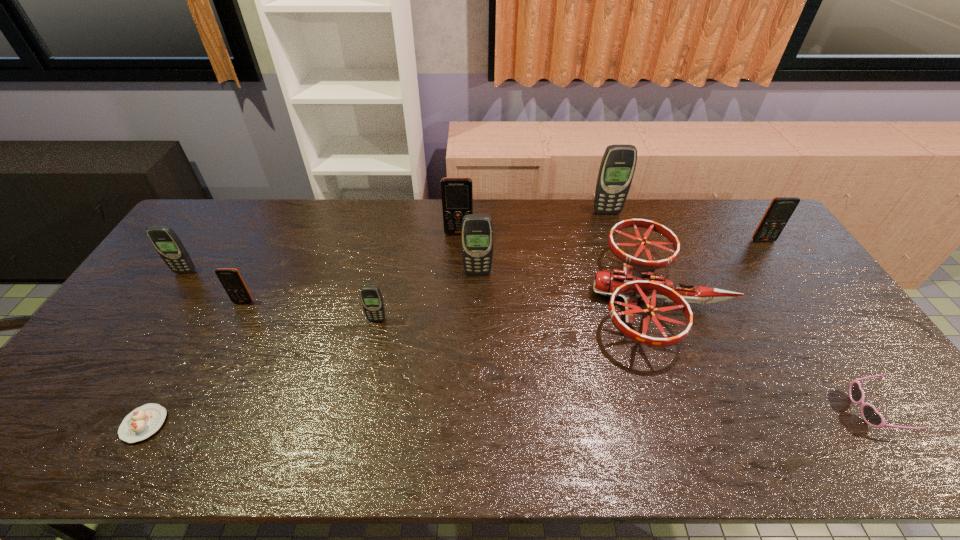
This screenshot has width=960, height=540. I want to click on vacant space that is in between the drone and the cupcake, so click(401, 361).

Identify which object is the third nearest to the nearest cellular telephone. Please provide its 2D coordinates. Your answer should be formatted as a tuple, i.e. [(x, y)], where the tuple contains the x and y coordinates of a point satisfying the conditions above.

[(457, 192)]

Locate an element on the screen. object that is the third closest to the third gray cellular telephone from left to right is located at coordinates [637, 280].

Identify which cellular telephone is the fourth closest to the sixth farthest cellular telephone. Please provide its 2D coordinates. Your answer should be formatted as a tuple, i.e. [(x, y)], where the tuple contains the x and y coordinates of a point satisfying the conditions above.

[(477, 236)]

Select which cellular telephone is the fourth closest to the nearest orange cellular telephone. Please provide its 2D coordinates. Your answer should be formatted as a tuple, i.e. [(x, y)], where the tuple contains the x and y coordinates of a point satisfying the conditions above.

[(477, 236)]

Select which gray cellular telephone is the second closest to the leftmost cellular telephone. Please provide its 2D coordinates. Your answer should be formatted as a tuple, i.e. [(x, y)], where the tuple contains the x and y coordinates of a point satisfying the conditions above.

[(477, 236)]

Where is `gray cellular telephone object that ranks as the third closest to the nearest cellular telephone`? The width and height of the screenshot is (960, 540). gray cellular telephone object that ranks as the third closest to the nearest cellular telephone is located at coordinates (618, 163).

Point out which orange cellular telephone is positioned as the nearest to the drone. Please provide its 2D coordinates. Your answer should be formatted as a tuple, i.e. [(x, y)], where the tuple contains the x and y coordinates of a point satisfying the conditions above.

[(781, 208)]

You are a GUI agent. You are given a task and a screenshot of the screen. Output one action in this format:
    pyautogui.click(x=<x>, y=<y>)
    Task: Click on the orange cellular telephone that can be found as the closest to the second nearest orange cellular telephone
    This screenshot has width=960, height=540.
    Given the screenshot: What is the action you would take?
    pyautogui.click(x=457, y=192)

Identify the location of vacant space that satisfies the following two spatial constraints: 1. on the screen of the sixth cellular telephone from left to right; 2. on the left side of the red drone. The image size is (960, 540). (636, 298).